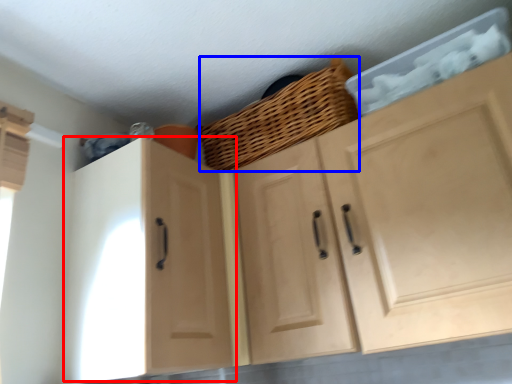
Question: Which of the following is the farthest to the observer, cabinetry (highlighted by a red box) or basket (highlighted by a blue box)?

Choices:
 (A) cabinetry
 (B) basket

Answer: (B)